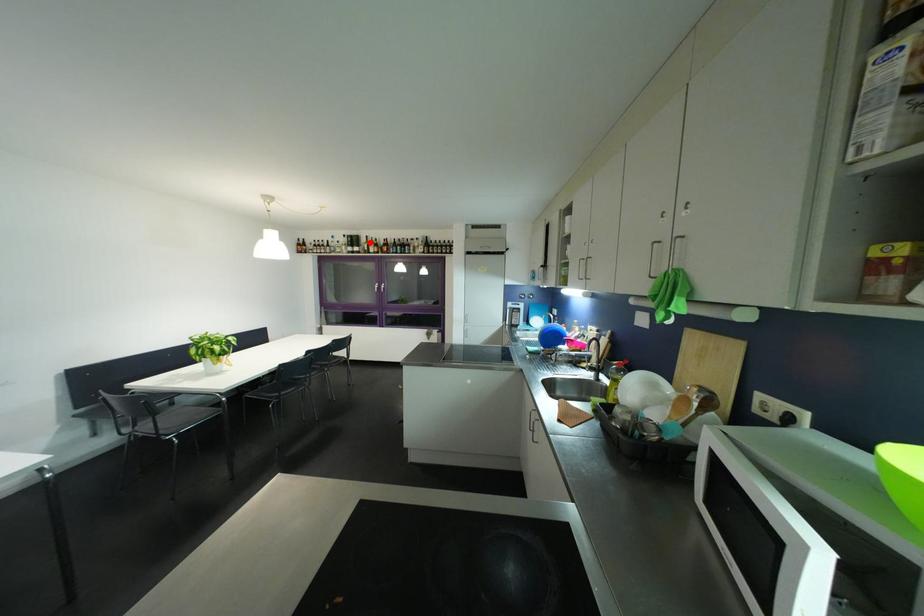
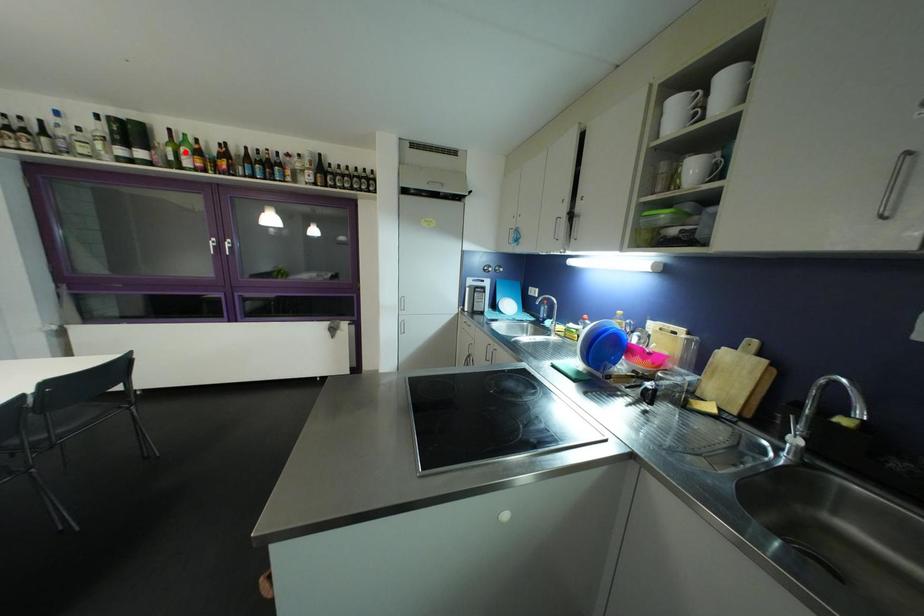
I am providing you with two images of the same scene from different viewpoints. A red point is marked on the first image and another point is marked on the second image. Do the highlighted points in image1 and image2 indicate the same real-world spot?

No